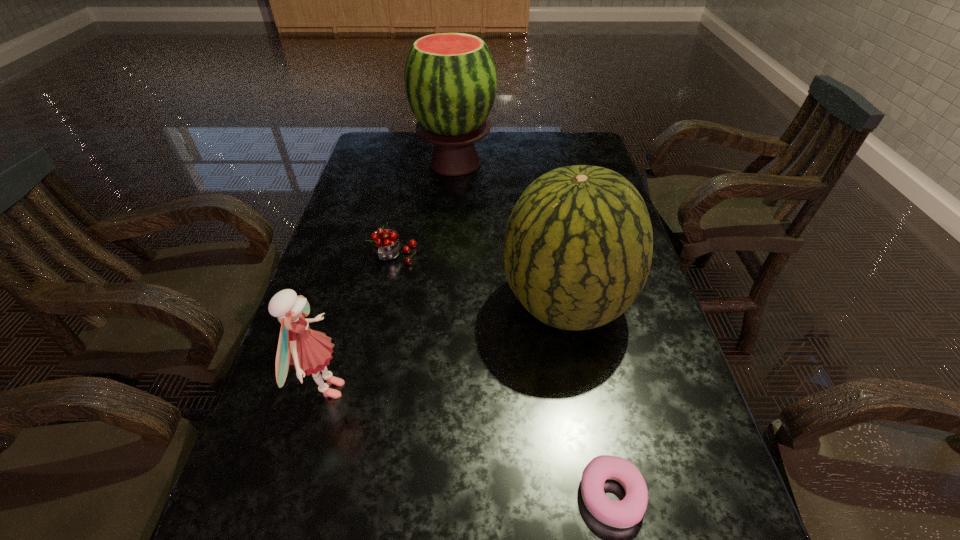
Locate an element on the screen. This screenshot has height=540, width=960. the farther watermelon is located at coordinates (450, 79).

Find the location of a particular element. Image resolution: width=960 pixels, height=540 pixels. the nearer watermelon is located at coordinates (578, 245).

Identify the location of doll. This screenshot has width=960, height=540. (309, 351).

Where is `the fourth tallest object`? The height and width of the screenshot is (540, 960). the fourth tallest object is located at coordinates (385, 245).

This screenshot has height=540, width=960. I want to click on pastry, so click(x=626, y=513).

The image size is (960, 540). What are the coordinates of `the shortest object` in the screenshot? It's located at (626, 513).

Image resolution: width=960 pixels, height=540 pixels. I want to click on blank space located on the right of the farthest object, so pyautogui.click(x=602, y=163).

I want to click on free spot located on the front of the nearer watermelon, so click(x=588, y=429).

Locate an element on the screen. vacant space located 0.270m on the front-facing side of the doll is located at coordinates pos(479,389).

At what (x,y) coordinates should I click in order to perform the action: click on vacant region located 0.360m on the handle side of the cherry. Please return your answer as a coordinate pair (x, y). The height and width of the screenshot is (540, 960). Looking at the image, I should click on pyautogui.click(x=366, y=395).